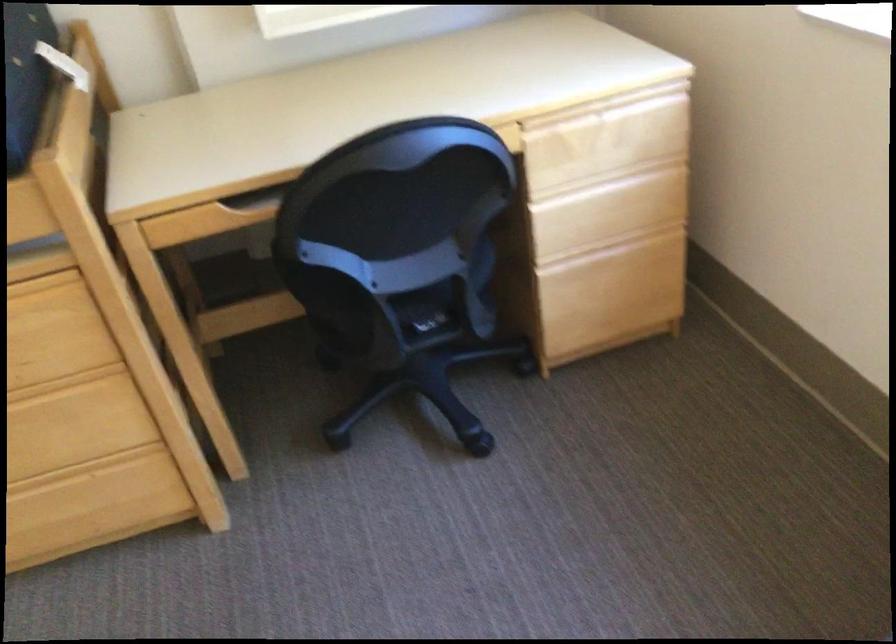
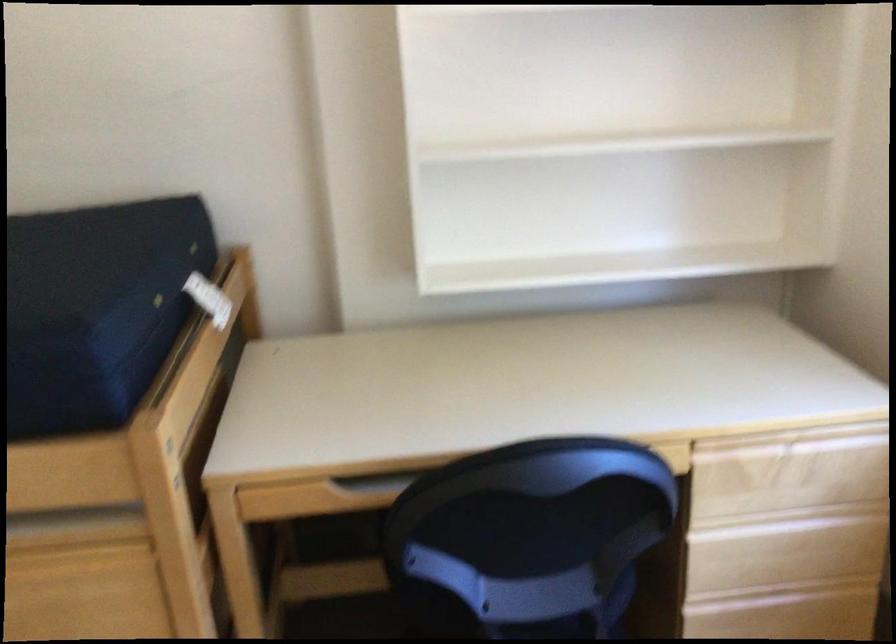
Question: The images are taken continuously from a first-person perspective. In which direction are you moving?

Choices:
 (A) Left
 (B) Right
 (C) Forward
 (D) Backward

Answer: (C)